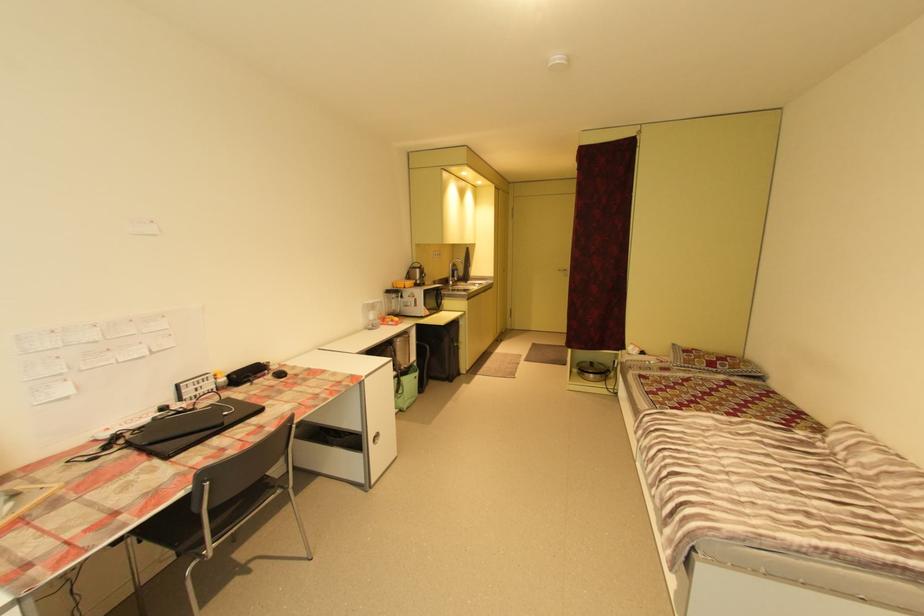
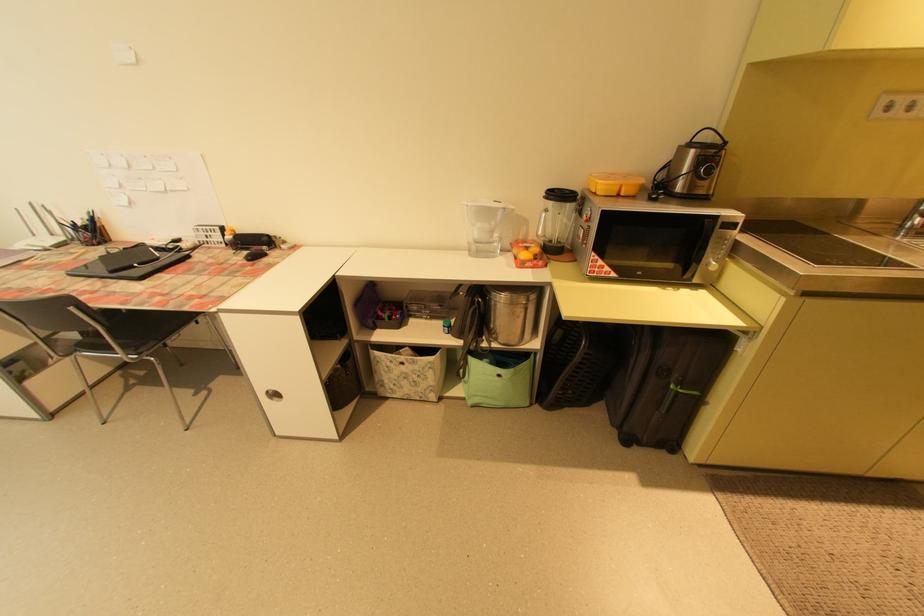
In the second image, find the point that corresponds to point (412, 283) in the first image.

(610, 182)